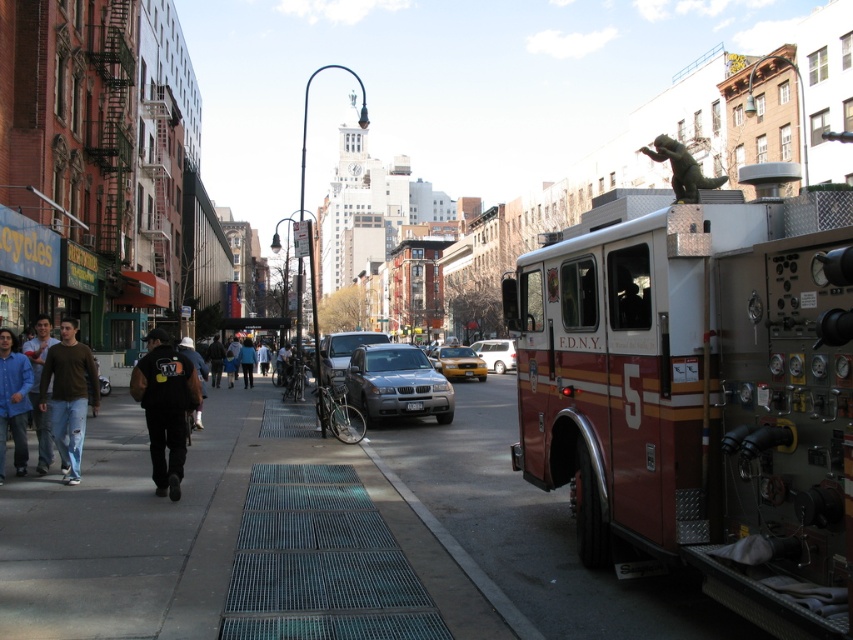
Question: Does silver metallic suv at center have a smaller size compared to black leather jacket at center?

Choices:
 (A) yes
 (B) no

Answer: (A)

Question: Which point is farther from the camera taking this photo?

Choices:
 (A) (209, 360)
 (B) (263, 364)

Answer: (B)

Question: Considering the real-world distances, which object is closest to the silver metallic van at center?

Choices:
 (A) red metallic fire truck at right
 (B) metallic silver suv at center

Answer: (B)

Question: Can you confirm if denim jacket at left is bigger than black leather jacket at center?

Choices:
 (A) yes
 (B) no

Answer: (B)

Question: Which is farther from the blue denim jeans at lower center?

Choices:
 (A) silver metallic van at center
 (B) blue denim jeans at center

Answer: (A)

Question: In this image, where is red metallic fire truck at right located relative to black leather jacket at center?

Choices:
 (A) above
 (B) below

Answer: (A)